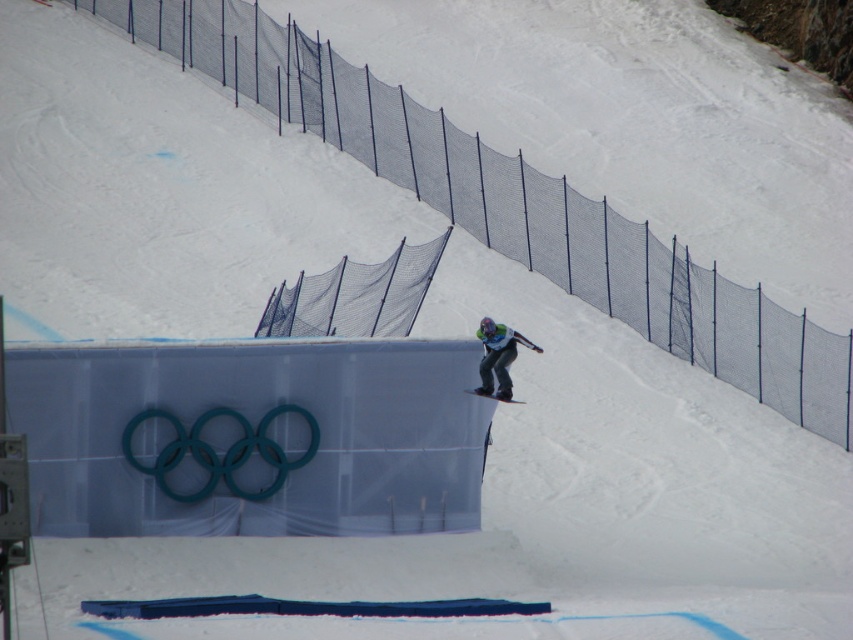
You are a photographer at the snowboarding event. You need to capture a photo where the green fabric snowboarder at center is clearly visible above the matte black snowboard at center. Based on the scene, can you confirm if this positioning is possible?

Yes, the green fabric snowboarder at center is positioned above the matte black snowboard at center, so capturing this photo is possible.

You are a photographer positioned at the bottom of the ramp capturing the snowboarder. Which object, the green fabric snowboarder at center or the matte black snowboard at center, is closer to your camera lens?

The green fabric snowboarder at center is closer to the camera lens because it is in front of the matte black snowboard at center.

You are a photographer positioned at the origin point of the coordinate system. You need to capture a photo of the green fabric snowboarder at center. According to the coordinates provided, in which direction should you adjust your camera to focus on the snowboarder?

The green fabric snowboarder at center is located at coordinates point [498,356]. Since the origin point is at [0,0], you should adjust your camera to the right and upwards to focus on the snowboarder.